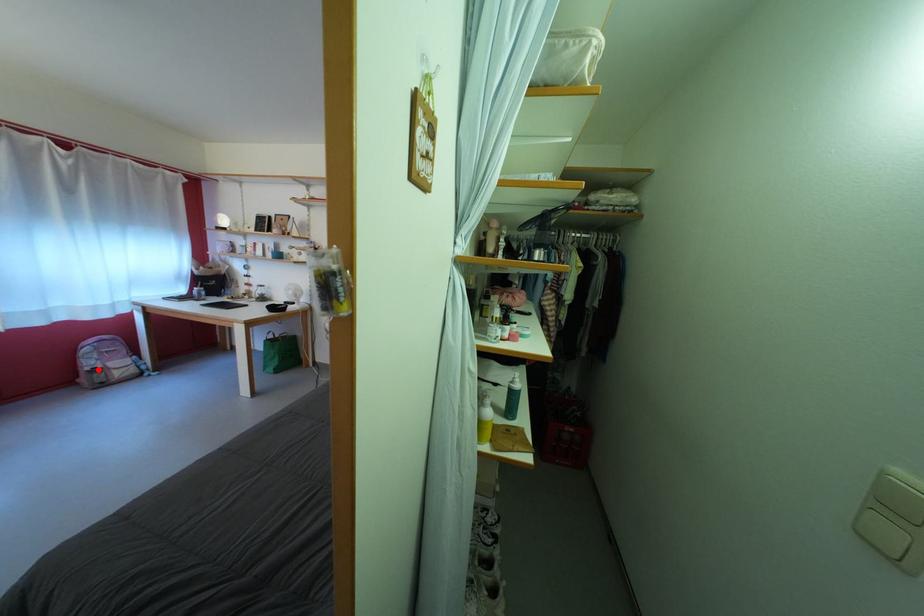
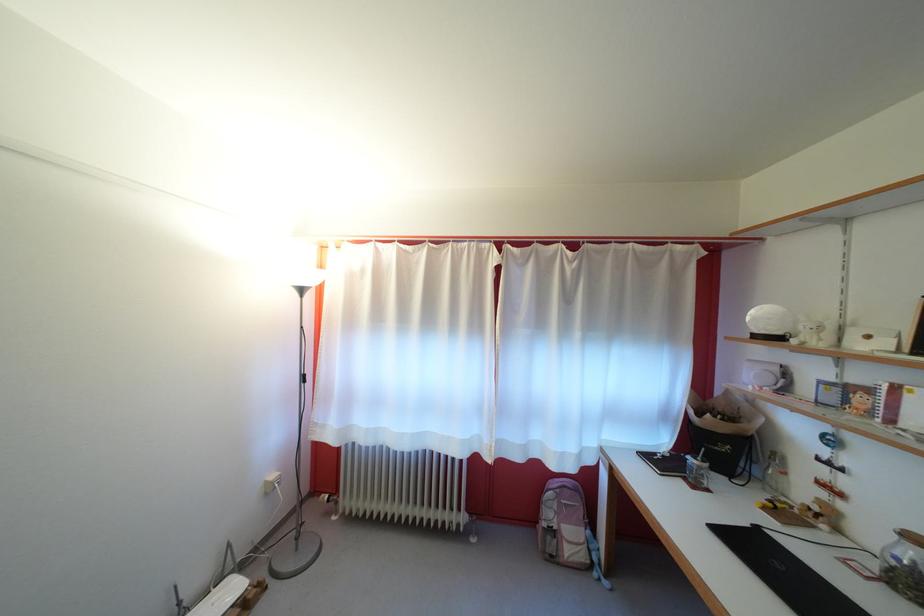
Where in the second image is the point corresponding to the highlighted location from the first image?

(556, 521)